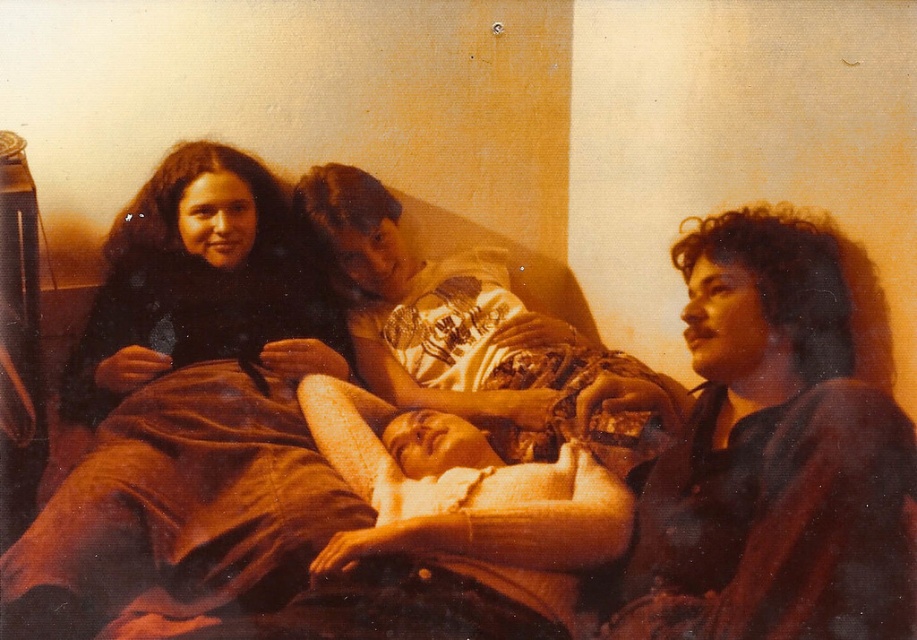
What is located at the coordinates point (772, 456)?

The dark brown hair at right is located at point (772, 456).

You are a photographer trying to capture a candid shot of the matte white shirt at center and the dark brown fur scarf at left. The camera has a depth of field that can focus on objects within a 10 inch range. Will both subjects be in focus?

The matte white shirt at center and dark brown fur scarf at left are 10.81 inches apart. Since the distance between them exceeds the camera sensor range of 10 inches, the camera cannot focus on both subjects simultaneously.